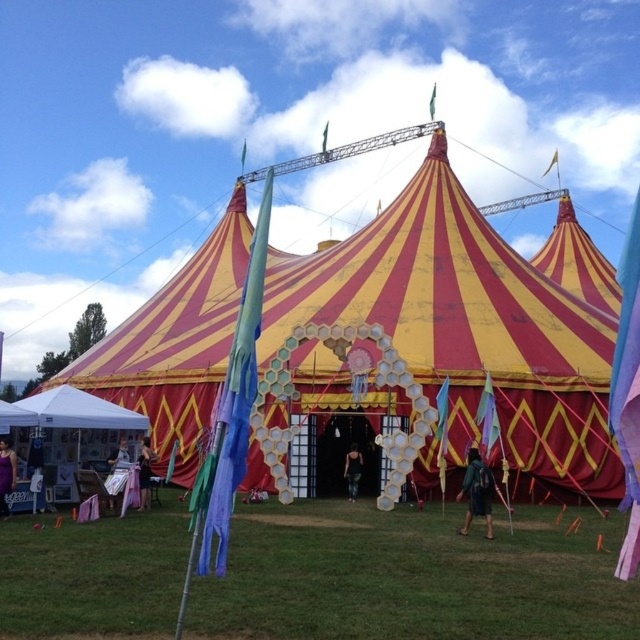
Question: Is black fabric dress at center bigger than dark blue jeans at center?

Choices:
 (A) yes
 (B) no

Answer: (A)

Question: Among these objects, which one is farthest from the camera?

Choices:
 (A) black fabric dress at center
 (B) metallic silver chair at lower left
 (C) dark green backpack at center

Answer: (B)

Question: Estimate the real-world distances between objects in this image. Which object is farther from the red/yellow striped tent at center?

Choices:
 (A) metallic silver chair at lower left
 (B) dark green backpack at center
 (C) dark blue jeans at center

Answer: (A)

Question: Does dark green backpack at center appear under black fabric dress at center?

Choices:
 (A) yes
 (B) no

Answer: (A)

Question: Which point is closer to the camera?

Choices:
 (A) green grass at lower center
 (B) dark green backpack at center
 (C) purple satin dress at center
 (D) dark blue jeans at center

Answer: (A)

Question: Is purple satin dress at center further to camera compared to metallic silver chair at lower left?

Choices:
 (A) no
 (B) yes

Answer: (A)